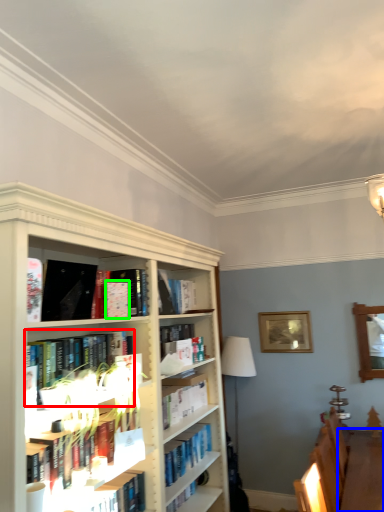
Question: Which object is positioned farthest from book (highlighted by a red box)? Select from table (highlighted by a blue box) and paperback book (highlighted by a green box).

Choices:
 (A) table
 (B) paperback book

Answer: (A)